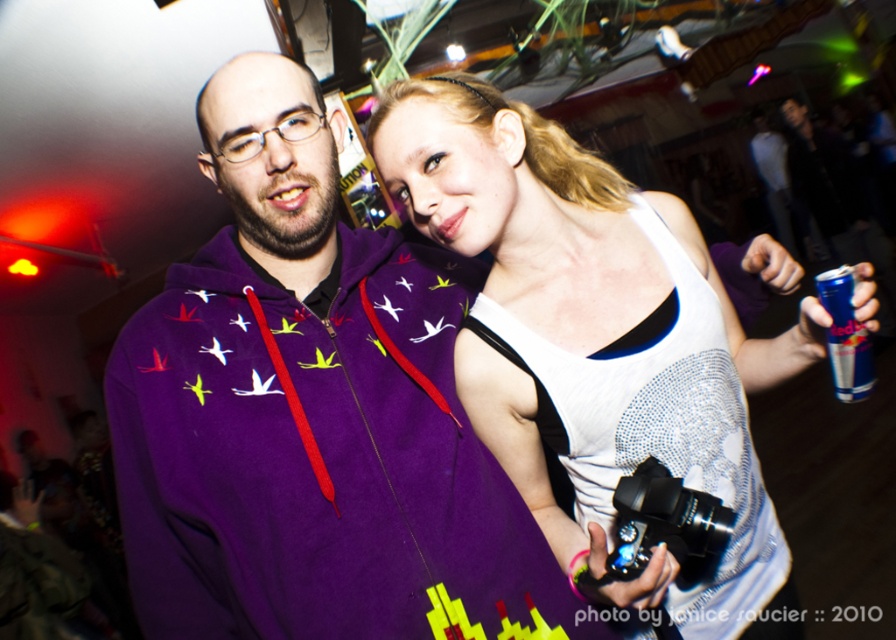
Question: Is purple fleece hoodie at center to the right of black metallic camera at center from the viewer's perspective?

Choices:
 (A) yes
 (B) no

Answer: (B)

Question: Which point is closer to the camera?

Choices:
 (A) (461, 260)
 (B) (826, 282)
 (C) (626, 528)

Answer: (B)

Question: Is purple fleece hoodie at center above red bull can at upper right?

Choices:
 (A) no
 (B) yes

Answer: (A)

Question: Can you confirm if purple fleece hoodie at center is bigger than red bull can at upper right?

Choices:
 (A) yes
 (B) no

Answer: (A)

Question: Which point is closer to the camera taking this photo?

Choices:
 (A) (200, 420)
 (B) (834, 371)
 (C) (596, 486)

Answer: (B)

Question: Which point is closer to the camera taking this photo?

Choices:
 (A) (851, 369)
 (B) (306, 182)

Answer: (A)